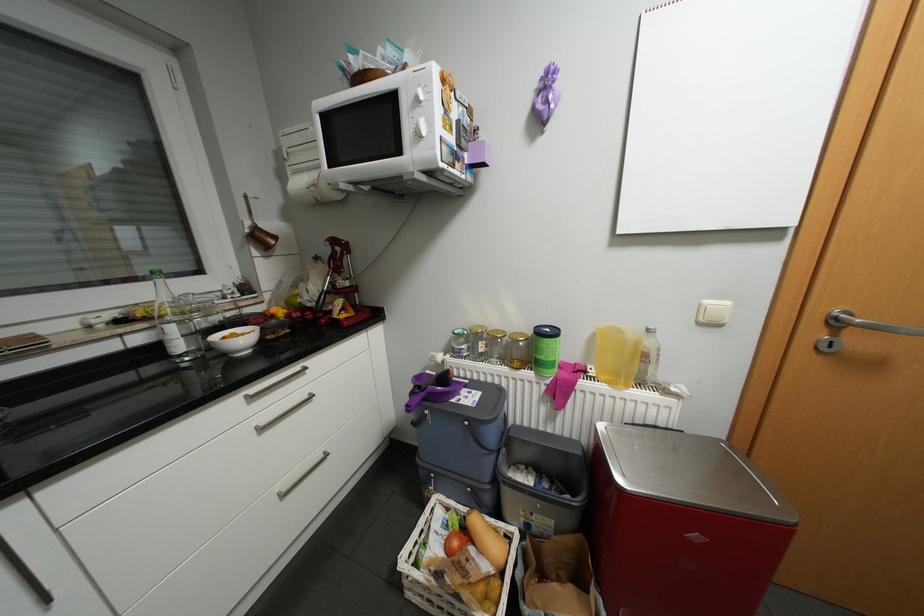
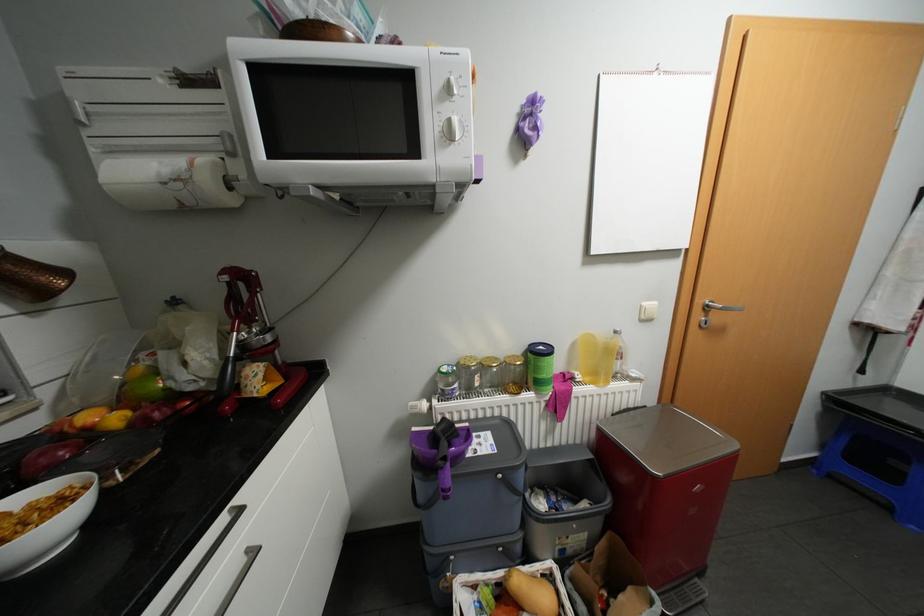
Where in the second image is the point corresponding to [430,97] from the first image?

(463, 89)